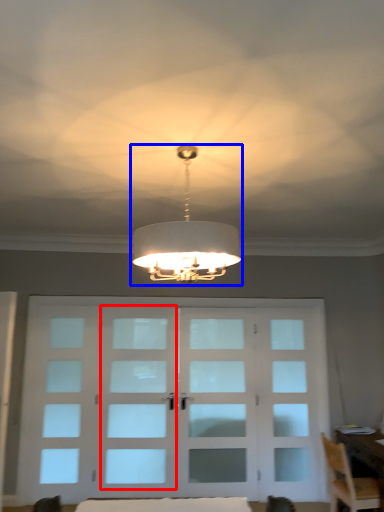
Question: Which object appears closest to the camera in this image, screen door (highlighted by a red box) or lamp (highlighted by a blue box)?

Choices:
 (A) screen door
 (B) lamp

Answer: (B)